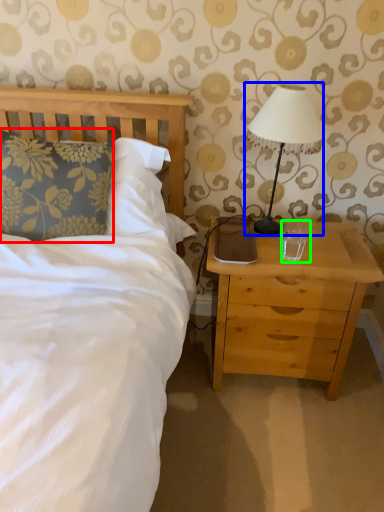
Question: Based on their relative distances, which object is nearer to pillow (highlighted by a red box)? Choose from table lamp (highlighted by a blue box) and coffee cup (highlighted by a green box).

Choices:
 (A) table lamp
 (B) coffee cup

Answer: (A)